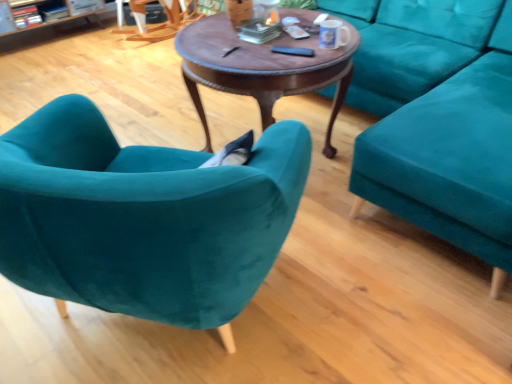
Locate an element on the screen. This screenshot has width=512, height=384. free space that is in between white plastic remote control at center, which appears as the first remote control when viewed from the top, and black matte remote control at center, which is counted as the 2th remote control, starting from the back is located at coordinates (293, 48).